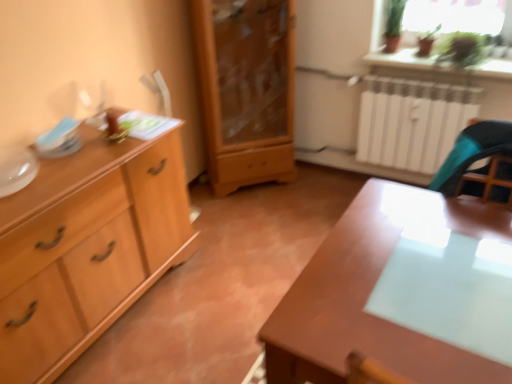
Question: Is green leafy plant at upper right to the right of transparent glass table at right from the viewer's perspective?

Choices:
 (A) no
 (B) yes

Answer: (B)

Question: Is green leafy plant at upper right aimed at transparent glass table at right?

Choices:
 (A) yes
 (B) no

Answer: (B)

Question: Is there a large distance between green leafy plant at upper right and transparent glass table at right?

Choices:
 (A) yes
 (B) no

Answer: (A)

Question: Is green leafy plant at upper right bigger than transparent glass table at right?

Choices:
 (A) no
 (B) yes

Answer: (A)

Question: From the image's perspective, is green leafy plant at upper right beneath transparent glass table at right?

Choices:
 (A) no
 (B) yes

Answer: (A)

Question: From a real-world perspective, is green leafy plant at upper right on top of transparent glass table at right?

Choices:
 (A) yes
 (B) no

Answer: (A)

Question: Is light wood cabinet at left, positioned as the 2th chest of drawers in right-to-left order, wider than transparent glass table at right?

Choices:
 (A) yes
 (B) no

Answer: (B)

Question: Is light wood cabinet at left, positioned as the 2th chest of drawers in right-to-left order, positioned far away from transparent glass table at right?

Choices:
 (A) no
 (B) yes

Answer: (B)

Question: Considering the relative sizes of light wood cabinet at left, positioned as the 2th chest of drawers in right-to-left order, and transparent glass table at right in the image provided, is light wood cabinet at left, positioned as the 2th chest of drawers in right-to-left order, taller than transparent glass table at right?

Choices:
 (A) no
 (B) yes

Answer: (B)

Question: Is the surface of light wood cabinet at left, the 1th chest of drawers positioned from the left, in direct contact with transparent glass table at right?

Choices:
 (A) yes
 (B) no

Answer: (B)

Question: Considering the relative sizes of light wood cabinet at left, the 1th chest of drawers positioned from the left, and transparent glass table at right in the image provided, is light wood cabinet at left, the 1th chest of drawers positioned from the left, shorter than transparent glass table at right?

Choices:
 (A) no
 (B) yes

Answer: (A)

Question: From a real-world perspective, is light wood cabinet at left, the 1th chest of drawers positioned from the left, positioned under transparent glass table at right based on gravity?

Choices:
 (A) yes
 (B) no

Answer: (A)

Question: Is glossy wood table at center not close to light wood cabinet at left, positioned as the 2th chest of drawers in right-to-left order?

Choices:
 (A) yes
 (B) no

Answer: (A)